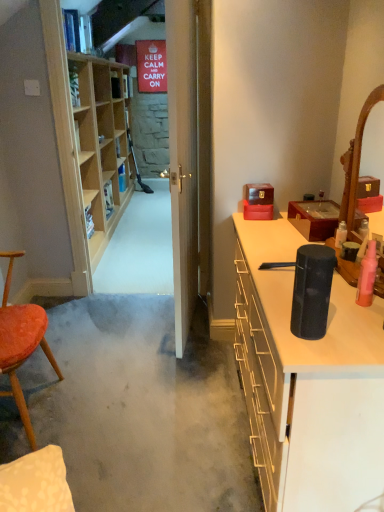
Where is `vacant space situated on the left part of pink matte bottle at right`? The height and width of the screenshot is (512, 384). vacant space situated on the left part of pink matte bottle at right is located at coordinates (327, 302).